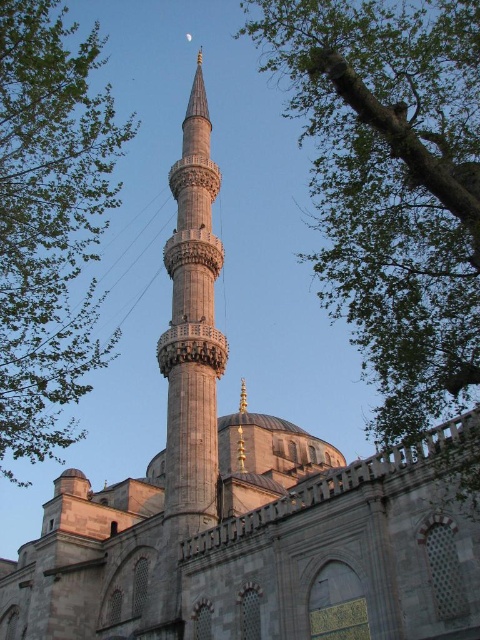
You are an architect analyzing the symmetry of the mosque. You notice two green leafy trees in the image. Which tree has a smaller width when comparing the green leafy tree at upper right and the green leafy tree at upper left?

The green leafy tree at upper right is thinner than the green leafy tree at upper left, so it has a smaller width.